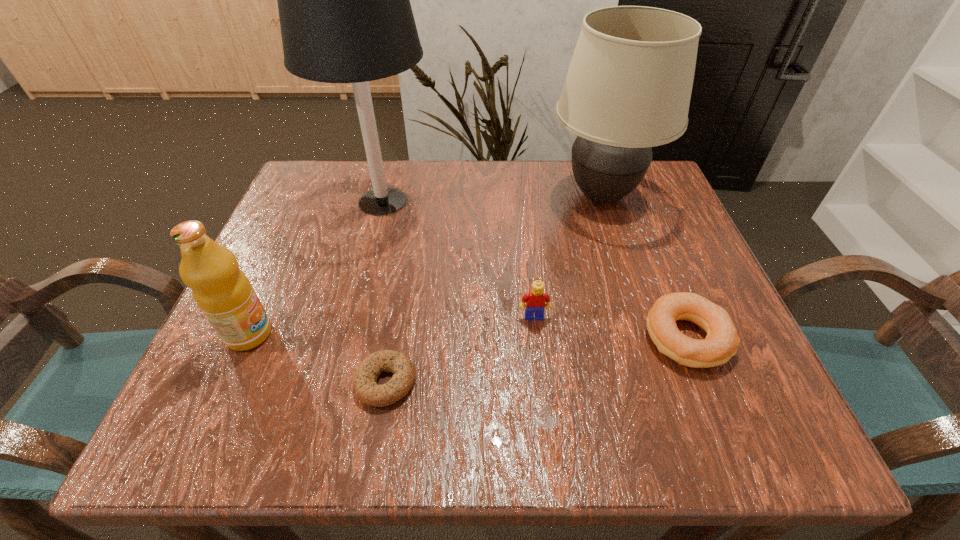
You are a GUI agent. You are given a task and a screenshot of the screen. Output one action in this format:
    pyautogui.click(x=<x>, y=<y>)
    Task: Click on the free space located 0.260m on the right of the tallest object
    
    Given the screenshot: What is the action you would take?
    pyautogui.click(x=549, y=201)

The width and height of the screenshot is (960, 540). In order to click on vacant space located 0.330m on the left of the lampshade in this screenshot , I will do `click(404, 196)`.

In order to click on vacant region located on the front label of the third tallest object in this screenshot , I will do `click(396, 334)`.

Image resolution: width=960 pixels, height=540 pixels. I want to click on vacant area situated 0.070m on the face of the fourth tallest object, so click(539, 355).

Identify the location of vacant space positioned 0.320m on the back of the taller bagel. (632, 199).

Find the location of `free space located 0.050m on the back of the shorter bagel`. free space located 0.050m on the back of the shorter bagel is located at coordinates (395, 330).

The width and height of the screenshot is (960, 540). Identify the location of table lamp that is at the far edge. (344, 6).

Locate an element on the screen. lampshade that is at the far edge is located at coordinates (628, 88).

Locate an element on the screen. The width and height of the screenshot is (960, 540). object at the near edge is located at coordinates (365, 385).

Identify the location of table lamp that is at the left edge. (344, 6).